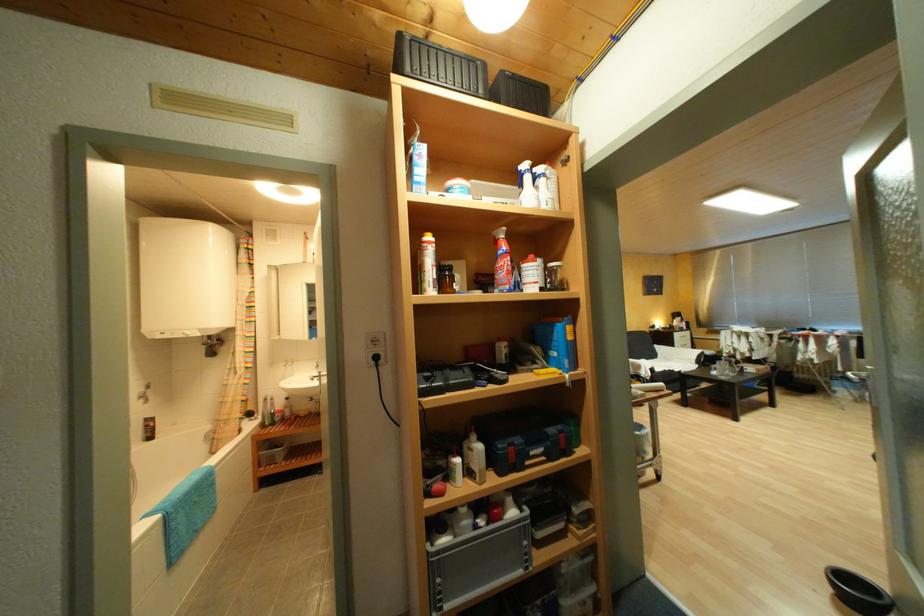
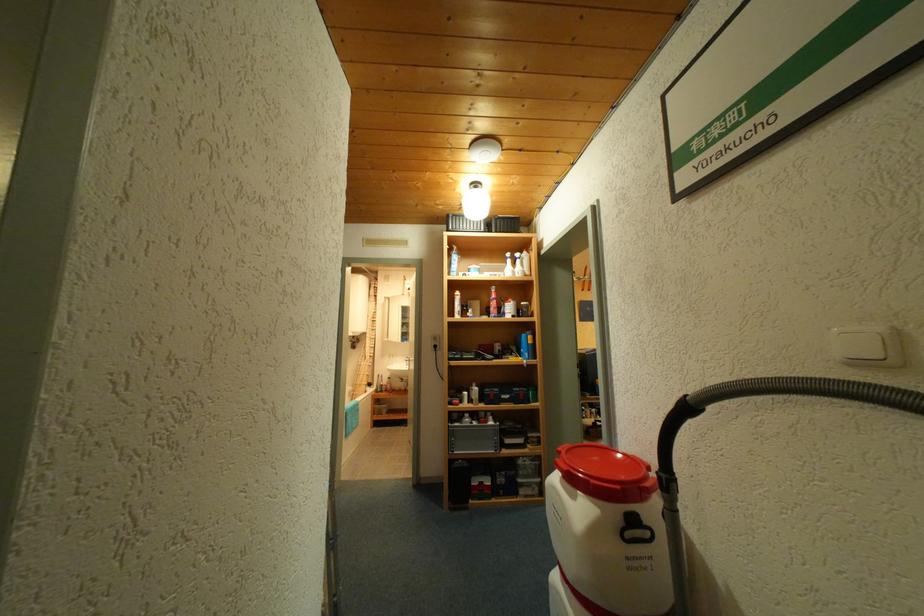
In the second image, find the point that corresponds to (x=551, y=169) in the first image.

(527, 256)